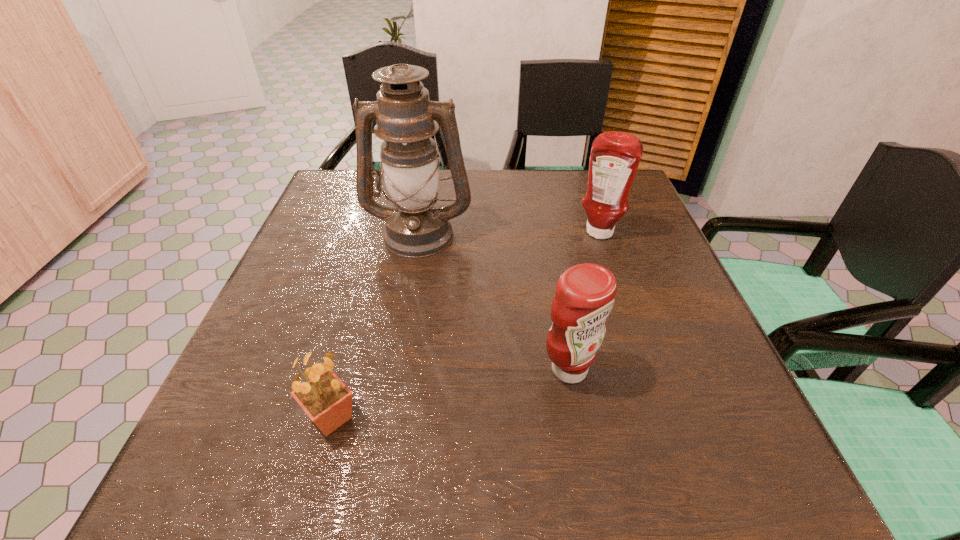
I want to click on vacant region that satisfies the following two spatial constraints: 1. on the front side of the oil lamp; 2. on the left side of the third farthest object, so click(396, 369).